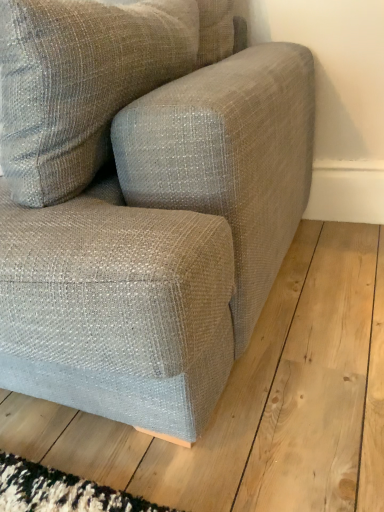
Describe the element at coordinates (142, 201) in the screenshot. The height and width of the screenshot is (512, 384). I see `textured fabric couch at center` at that location.

Find the location of a particular element. textured fabric couch at center is located at coordinates (142, 201).

This screenshot has height=512, width=384. I want to click on textured fabric couch at center, so click(142, 201).